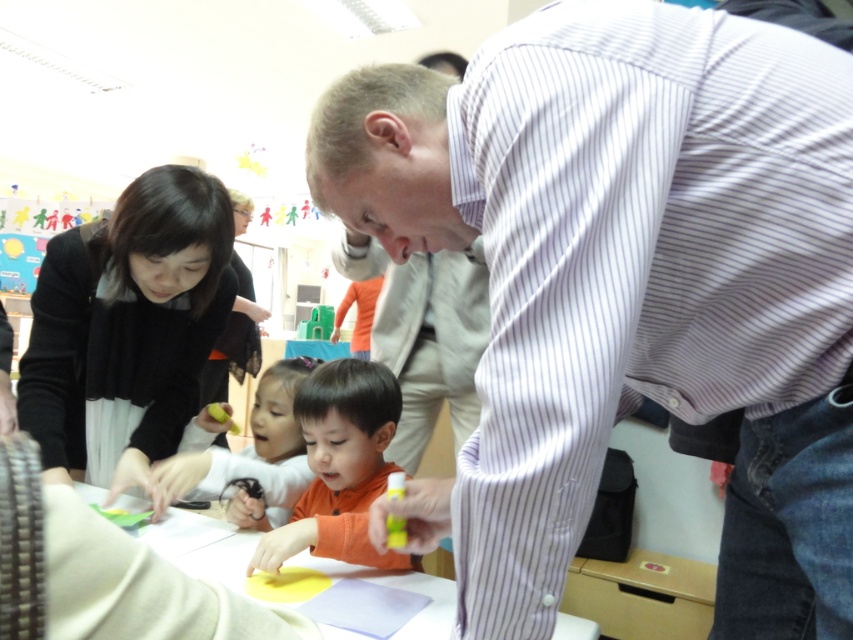
Question: Considering the real-world distances, which object is closest to the smooth yellow paper at center?

Choices:
 (A) orange matte shirt at center
 (B) smooth orange shirt at center

Answer: (A)

Question: Which object appears closest to the camera in this image?

Choices:
 (A) orange matte shirt at center
 (B) smooth orange shirt at center

Answer: (A)

Question: Is white striped shirt at upper right to the right of smooth yellow paper at center from the viewer's perspective?

Choices:
 (A) no
 (B) yes

Answer: (B)

Question: Estimate the real-world distances between objects in this image. Which object is closer to the smooth yellow paper at center?

Choices:
 (A) smooth orange shirt at center
 (B) orange matte shirt at center
 (C) white striped shirt at upper right

Answer: (B)

Question: Considering the relative positions of white striped shirt at upper right and smooth yellow paper at center in the image provided, where is white striped shirt at upper right located with respect to smooth yellow paper at center?

Choices:
 (A) above
 (B) below

Answer: (A)

Question: Does orange matte shirt at center have a larger size compared to smooth orange shirt at center?

Choices:
 (A) yes
 (B) no

Answer: (B)